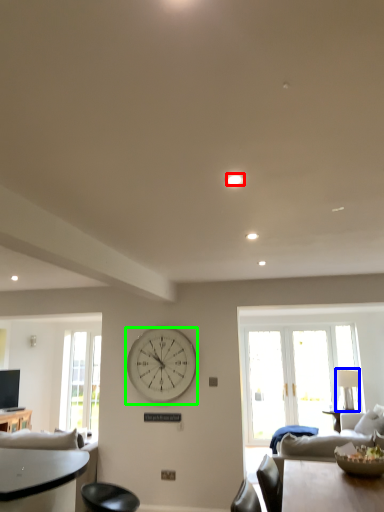
Question: Based on their relative distances, which object is nearer to light (highlighted by a red box)? Choose from lamp (highlighted by a blue box) and wall clock (highlighted by a green box).

Choices:
 (A) lamp
 (B) wall clock

Answer: (B)